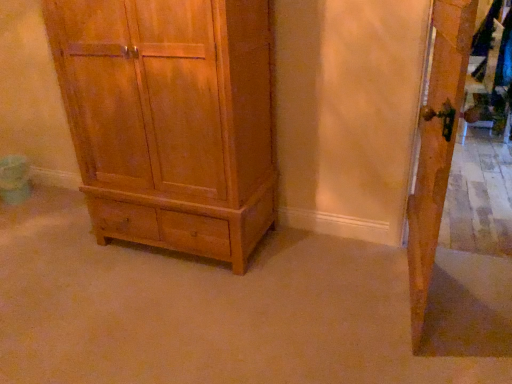
Question: Is matte wood chest of drawers at center bigger or smaller than wooden door at right?

Choices:
 (A) small
 (B) big

Answer: (B)

Question: Does point (134, 67) appear closer or farther from the camera than point (415, 261)?

Choices:
 (A) farther
 (B) closer

Answer: (A)

Question: From a real-world perspective, is matte wood chest of drawers at center physically located above or below wooden door at right?

Choices:
 (A) below
 (B) above

Answer: (B)

Question: Is wooden door at right wider or thinner than matte wood chest of drawers at center?

Choices:
 (A) wide
 (B) thin

Answer: (B)

Question: Is wooden door at right in front of or behind matte wood chest of drawers at center in the image?

Choices:
 (A) behind
 (B) front

Answer: (B)

Question: Is wooden door at right taller or shorter than matte wood chest of drawers at center?

Choices:
 (A) short
 (B) tall

Answer: (A)

Question: From the image's perspective, is wooden door at right positioned above or below matte wood chest of drawers at center?

Choices:
 (A) above
 (B) below

Answer: (B)